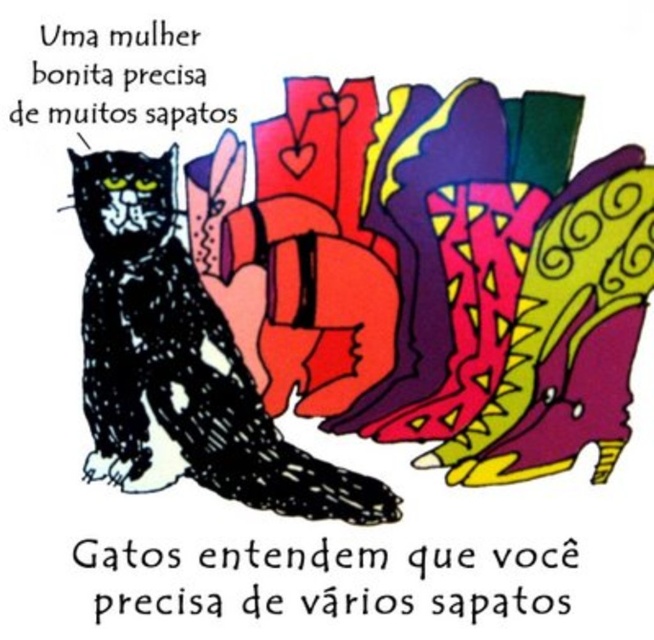
Does black textured cat at left appear on the left side of black glossy cat at left?

No, black textured cat at left is not to the left of black glossy cat at left.

Does black textured cat at left have a greater height compared to black glossy cat at left?

Indeed, black textured cat at left has a greater height compared to black glossy cat at left.

Where is `black textured cat at left`? The height and width of the screenshot is (640, 654). black textured cat at left is located at coordinates (182, 358).